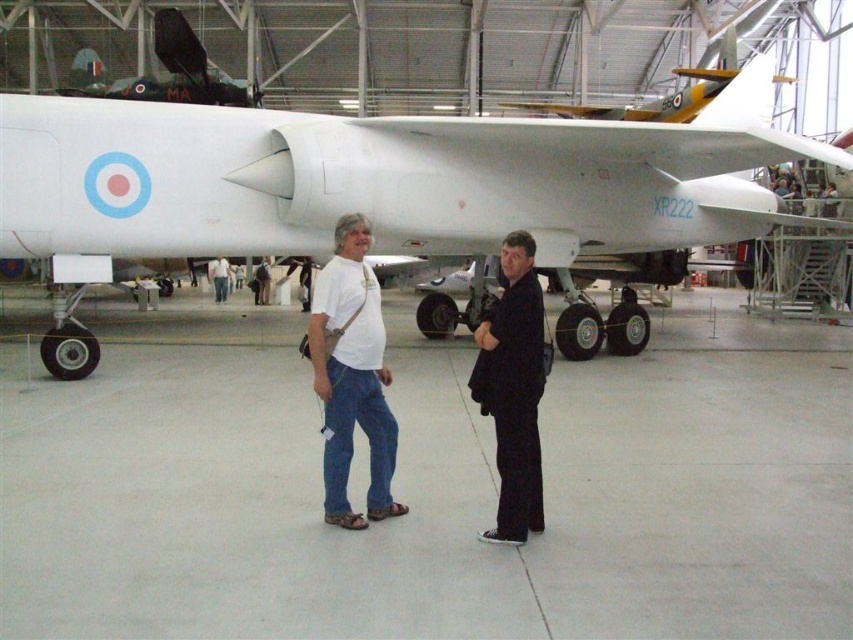
From the picture: You are a photographer positioned in front of the scene. You want to take a photo of the black matte suit at center and the white matte airplane at center without any obstruction. Based on their positions, which subject should you focus on first to ensure both are in frame?

The black matte suit at center is behind the white matte airplane at center, so you should focus on the white matte airplane at center first to ensure both are visible without obstruction.